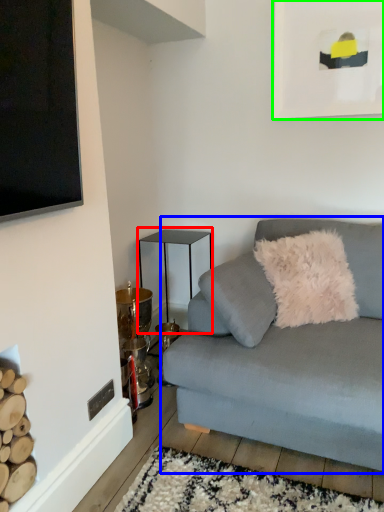
Question: Which object is positioned farthest from table (highlighted by a red box)? Select from studio couch (highlighted by a blue box) and picture frame (highlighted by a green box).

Choices:
 (A) studio couch
 (B) picture frame

Answer: (B)